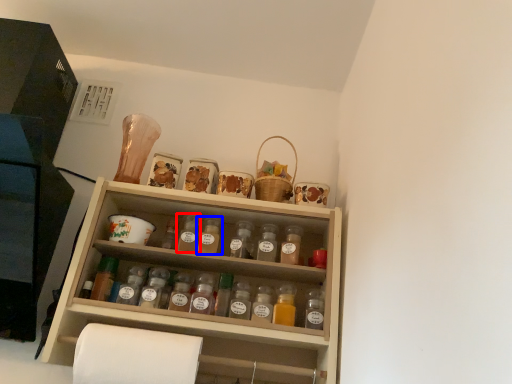
Question: Which point is closer to the camera, bottle (highlighted by a red box) or bottle (highlighted by a blue box)?

Choices:
 (A) bottle
 (B) bottle

Answer: (B)